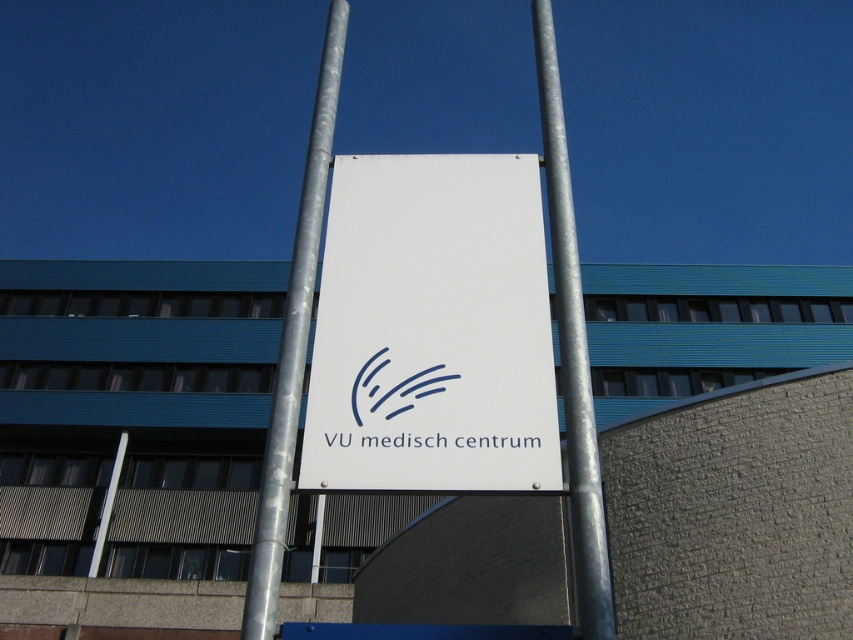
You are standing in front of the signboard between the two metallic poles. You want to reach a point that is exactly 3.57 meters away from your current position. Can you determine if the point at coordinates point (451, 444) is the correct location to reach?

The point at coordinates point (451, 444) is 3.57 meters away from the camera, so yes, it is the correct location to reach.

You are a maintenance worker needing to replace a light bulb on the white matte sign at center and the metallic silver pole at center. Which object requires you to climb higher?

The metallic silver pole at center requires climbing higher because it is taller than the white matte sign at center.

You are standing in front of a signboard between two metallic poles. You need to locate the metallic silver pole at center. Where is it positioned in terms of coordinates?

The metallic silver pole at center is positioned at coordinates point [572,353].